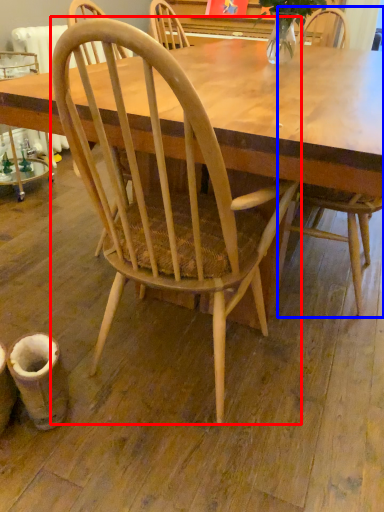
Question: Which object appears farthest to the camera in this image, chair (highlighted by a red box) or chair (highlighted by a blue box)?

Choices:
 (A) chair
 (B) chair

Answer: (B)